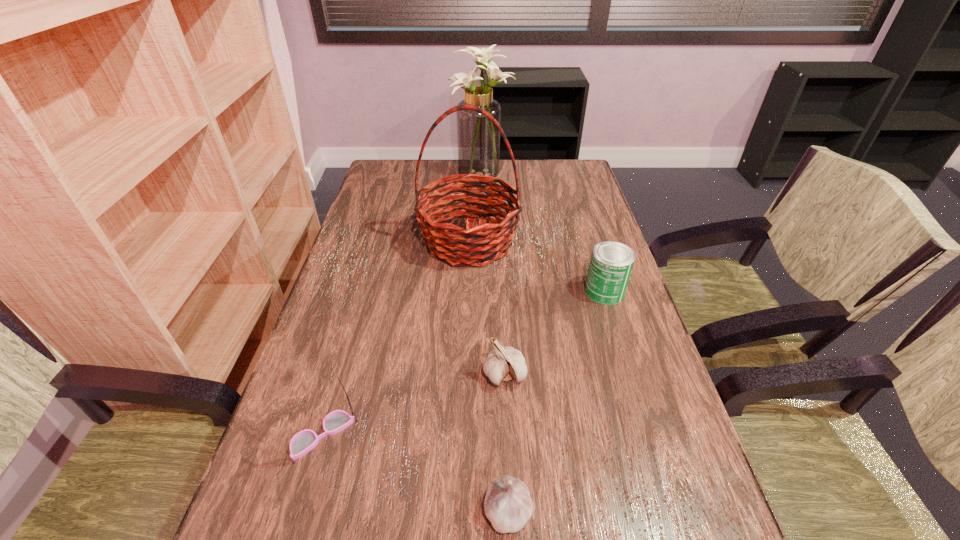
You are a GUI agent. You are given a task and a screenshot of the screen. Output one action in this format:
    pyautogui.click(x=<x>, y=<y>)
    Task: Click on the flower arrangement
    The width and height of the screenshot is (960, 540).
    Given the screenshot: What is the action you would take?
    pyautogui.click(x=478, y=140)

Where is `basket`? basket is located at coordinates (444, 237).

You are a GUI agent. You are given a task and a screenshot of the screen. Output one action in this format:
    pyautogui.click(x=<x>, y=<y>)
    Task: Click on the third farthest object
    
    Given the screenshot: What is the action you would take?
    pyautogui.click(x=611, y=264)

Identify the location of the rightmost object. The image size is (960, 540). (611, 264).

Locate an element on the screen. This screenshot has width=960, height=540. the farther garlic is located at coordinates (505, 363).

The width and height of the screenshot is (960, 540). In order to click on spectacles in this screenshot , I will do `click(304, 441)`.

You are a GUI agent. You are given a task and a screenshot of the screen. Output one action in this format:
    pyautogui.click(x=<x>, y=<y>)
    Task: Click on the leftmost object
    
    Given the screenshot: What is the action you would take?
    pyautogui.click(x=304, y=441)

The width and height of the screenshot is (960, 540). I want to click on the nearest object, so click(x=507, y=505).

Locate an element on the screen. free spot located 0.070m on the front of the farthest object is located at coordinates (482, 197).

In order to click on vacant space located on the left of the fifth nearest object in this screenshot , I will do coord(398,241).